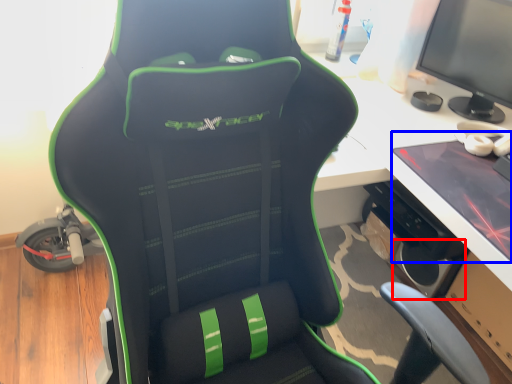
Question: Among these objects, which one is farthest to the camera, speaker (highlighted by a red box) or laptop (highlighted by a blue box)?

Choices:
 (A) speaker
 (B) laptop

Answer: (A)